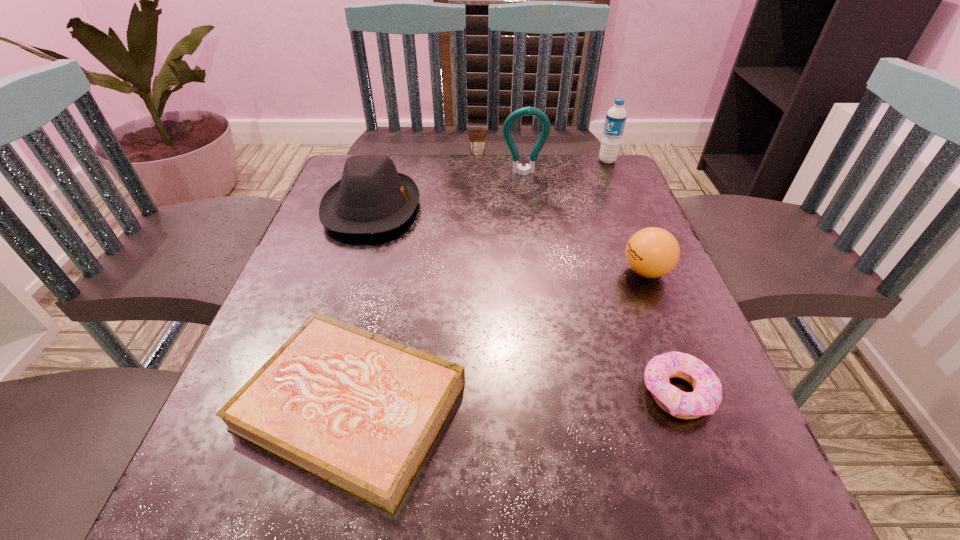
Image resolution: width=960 pixels, height=540 pixels. What are the coordinates of `object positioned at the near edge` in the screenshot? It's located at (359, 410).

Where is `fedora situated at the left edge`? Image resolution: width=960 pixels, height=540 pixels. fedora situated at the left edge is located at coordinates (372, 197).

Locate an element on the screen. hardback book located at the left edge is located at coordinates (359, 410).

Where is `water bottle situated at the right edge`? The height and width of the screenshot is (540, 960). water bottle situated at the right edge is located at coordinates (616, 116).

I want to click on ping-pong ball situated at the right edge, so click(652, 252).

At what (x,y) coordinates should I click in order to perform the action: click on doughnut at the right edge. Please return your answer as a coordinate pair (x, y). Looking at the image, I should click on (707, 391).

You are a GUI agent. You are given a task and a screenshot of the screen. Output one action in this format:
    pyautogui.click(x=<x>, y=<y>)
    Task: Click on the object that is at the far left corner
    
    Given the screenshot: What is the action you would take?
    pyautogui.click(x=372, y=197)

What are the coordinates of `object that is at the near left corner` in the screenshot? It's located at (359, 410).

The height and width of the screenshot is (540, 960). In order to click on object positioned at the far right corner in this screenshot , I will do `click(616, 116)`.

Where is `vacant position at the far edge of the desktop`? Image resolution: width=960 pixels, height=540 pixels. vacant position at the far edge of the desktop is located at coordinates (456, 154).